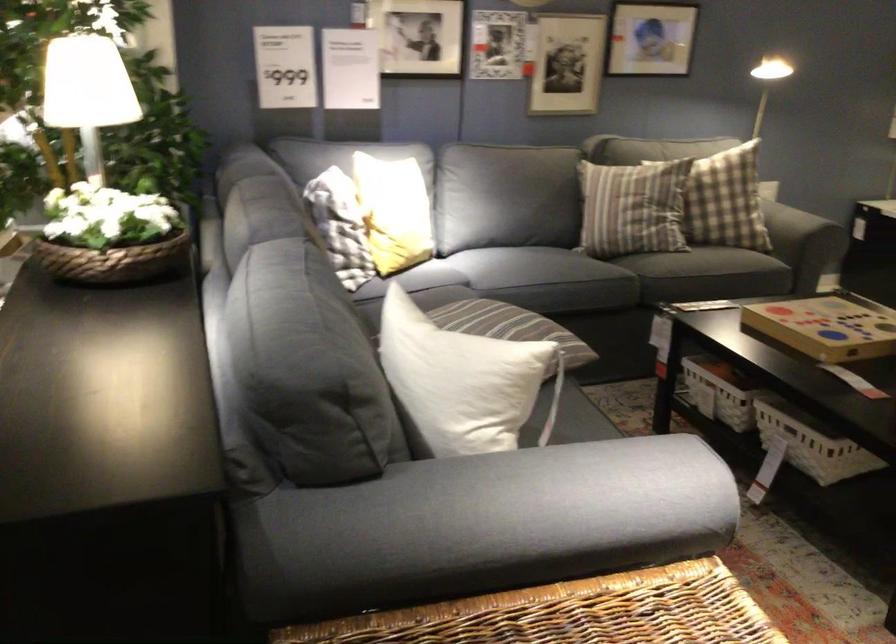
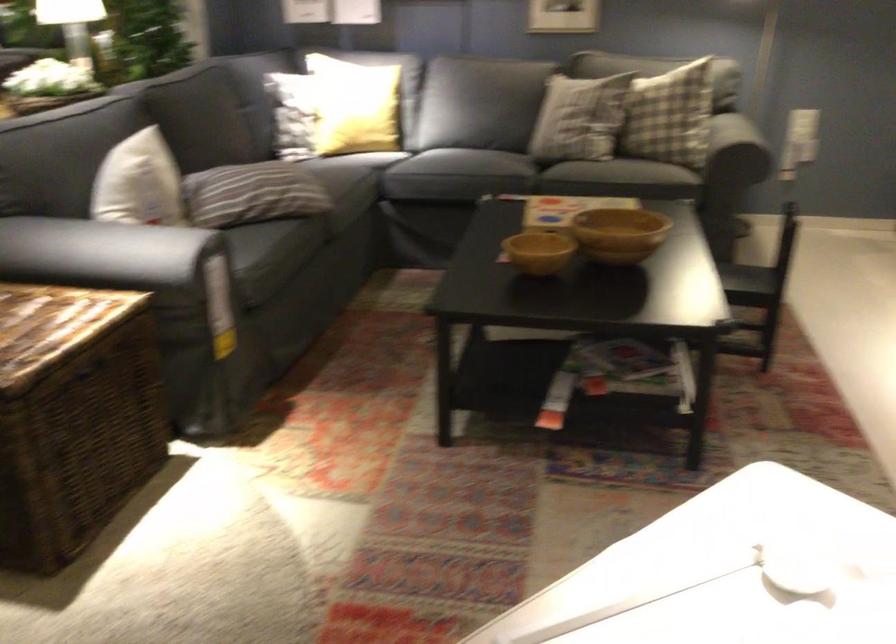
Question: I am providing you with two images of the same scene from different viewpoints. Which of the following objects are not visible in image2?

Choices:
 (A) plaid pillow
 (B) small wooden bowl
 (C) dark sofa armrest
 (D) none of these

Answer: (D)